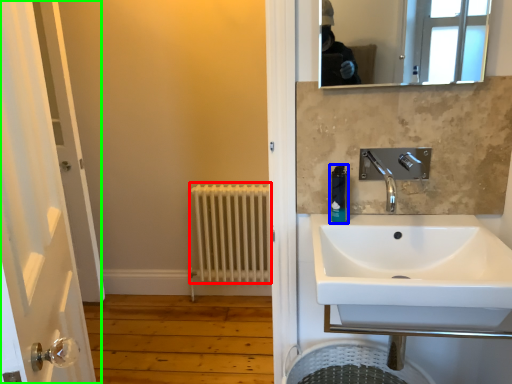
Question: Which object is positioned farthest from radiator (highlighted by a red box)? Select from soap dispenser (highlighted by a blue box) and door (highlighted by a green box).

Choices:
 (A) soap dispenser
 (B) door

Answer: (A)